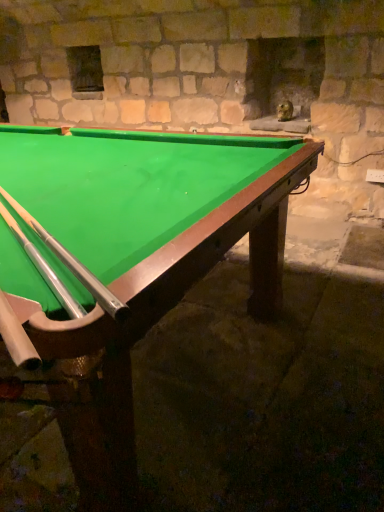
Question: Can you confirm if green felt billiard table at center is positioned to the right of silver/smooth cue at lower left?

Choices:
 (A) yes
 (B) no

Answer: (B)

Question: Can you see green felt billiard table at center touching silver/smooth cue at lower left?

Choices:
 (A) no
 (B) yes

Answer: (A)

Question: Would you say green felt billiard table at center contains silver/smooth cue at lower left?

Choices:
 (A) yes
 (B) no

Answer: (A)

Question: From a real-world perspective, is green felt billiard table at center located beneath silver/smooth cue at lower left?

Choices:
 (A) yes
 (B) no

Answer: (A)

Question: Does green felt billiard table at center turn towards silver/smooth cue at lower left?

Choices:
 (A) yes
 (B) no

Answer: (B)

Question: From the image's perspective, is green felt billiard table at center on silver/smooth cue at lower left?

Choices:
 (A) no
 (B) yes

Answer: (A)

Question: From a real-world perspective, is silver/smooth cue at lower left located higher than green felt billiard table at center?

Choices:
 (A) yes
 (B) no

Answer: (A)

Question: Can you confirm if silver/smooth cue at lower left is thinner than green felt billiard table at center?

Choices:
 (A) yes
 (B) no

Answer: (A)

Question: Does silver/smooth cue at lower left have a smaller size compared to green felt billiard table at center?

Choices:
 (A) yes
 (B) no

Answer: (A)

Question: From the image's perspective, is silver/smooth cue at lower left under green felt billiard table at center?

Choices:
 (A) yes
 (B) no

Answer: (B)

Question: Could you tell me if silver/smooth cue at lower left is facing green felt billiard table at center?

Choices:
 (A) no
 (B) yes

Answer: (B)

Question: Considering the relative sizes of silver/smooth cue at lower left and green felt billiard table at center in the image provided, is silver/smooth cue at lower left wider than green felt billiard table at center?

Choices:
 (A) no
 (B) yes

Answer: (A)

Question: Considering the positions of green felt billiard table at center and silver/smooth cue at lower left in the image, is green felt billiard table at center wider or thinner than silver/smooth cue at lower left?

Choices:
 (A) wide
 (B) thin

Answer: (A)